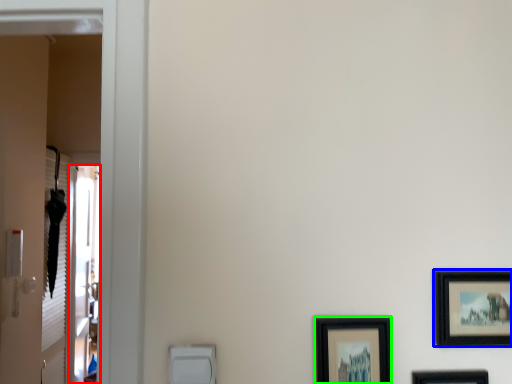
Question: Which object is positioned closest to screen door (highlighted by a red box)? Select from picture frame (highlighted by a blue box) and picture frame (highlighted by a green box).

Choices:
 (A) picture frame
 (B) picture frame

Answer: (B)